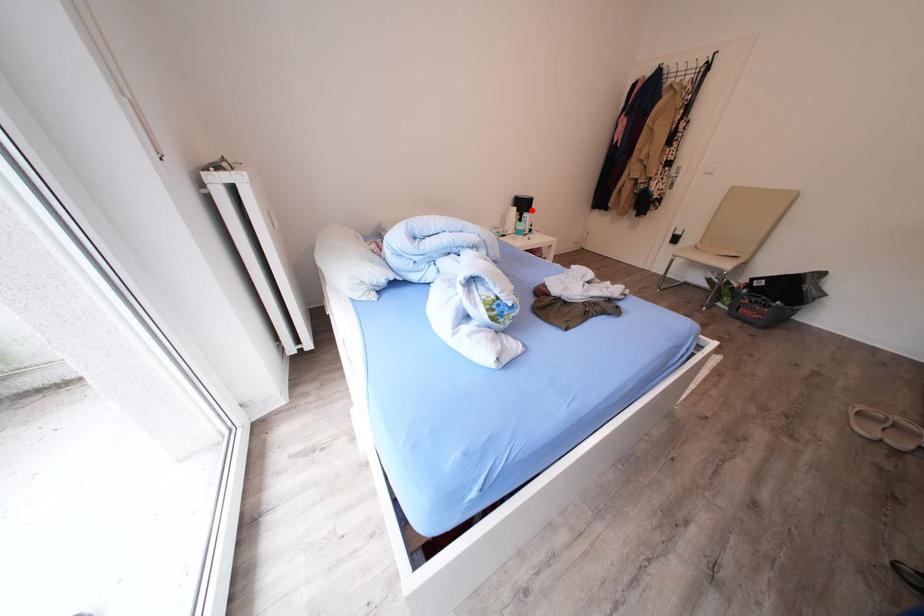
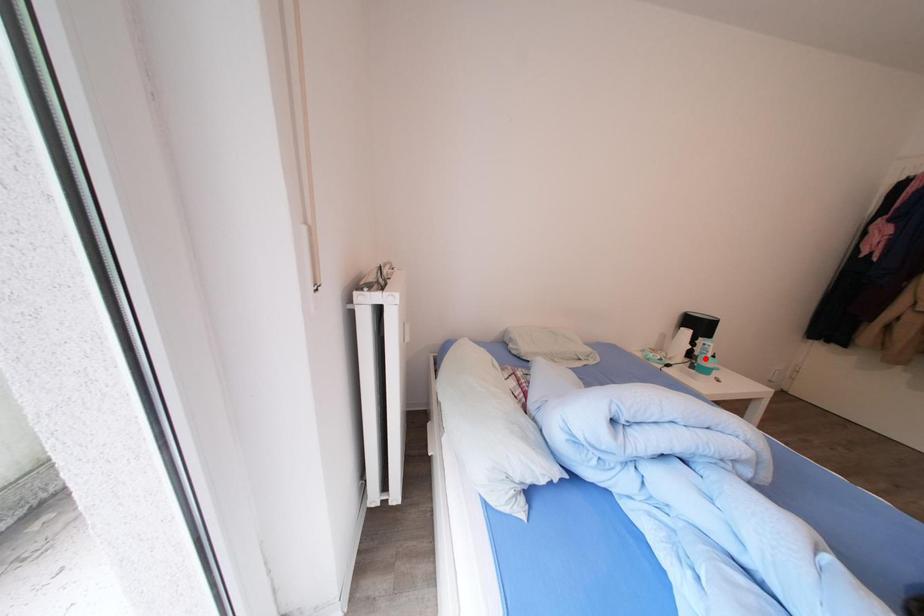
I am providing you with two images of the same scene from different viewpoints. A red point is marked on the first image and another point is marked on the second image. Do the highlighted points in image1 and image2 indicate the same real-world spot?

No